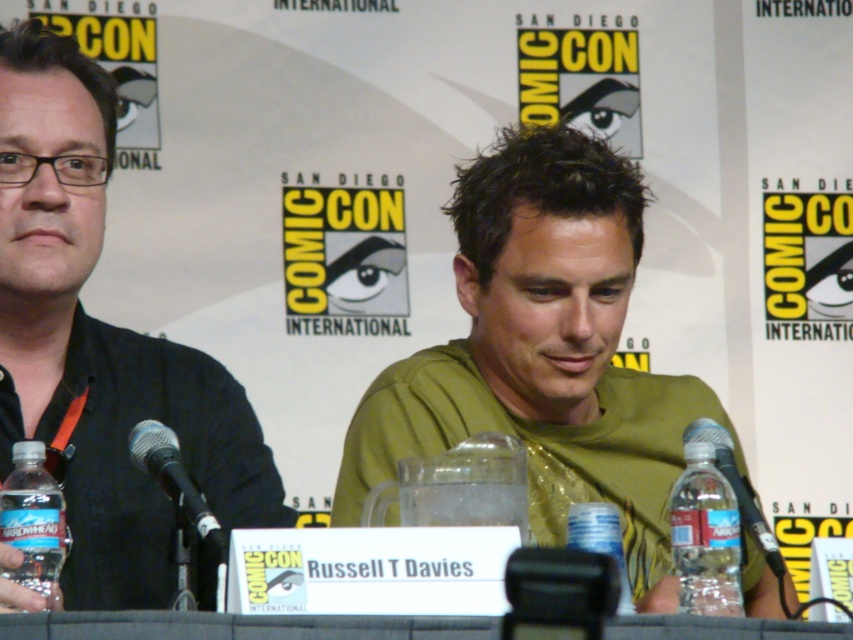
Is silver metallic microphone at left taller than black plastic microphone at right?

Yes, silver metallic microphone at left is taller than black plastic microphone at right.

Between silver metallic microphone at left and black plastic microphone at right, which one appears on the right side from the viewer's perspective?

Positioned to the right is black plastic microphone at right.

Locate an element on the screen. The height and width of the screenshot is (640, 853). silver metallic microphone at left is located at coordinates (175, 481).

Can you confirm if green matte t-shirt at center is positioned above clear plastic bottle at lower right?

Correct, green matte t-shirt at center is located above clear plastic bottle at lower right.

Is green matte t-shirt at center smaller than clear plastic bottle at lower right?

Correct, green matte t-shirt at center occupies less space than clear plastic bottle at lower right.

Measure the distance between green matte t-shirt at center and camera.

→ A distance of 60.48 feet exists between green matte t-shirt at center and camera.

Image resolution: width=853 pixels, height=640 pixels. Identify the location of green matte t-shirt at center. (543, 353).

Between point (442, 636) and point (61, 536), which one is positioned behind?

The point (61, 536) is behind.

Between transparent plastic table at center and clear plastic water bottle at lower left, which one is positioned lower?

transparent plastic table at center is lower down.

Where is `transparent plastic table at center`? transparent plastic table at center is located at coordinates (241, 625).

Locate an element on the screen. The height and width of the screenshot is (640, 853). transparent plastic table at center is located at coordinates (241, 625).